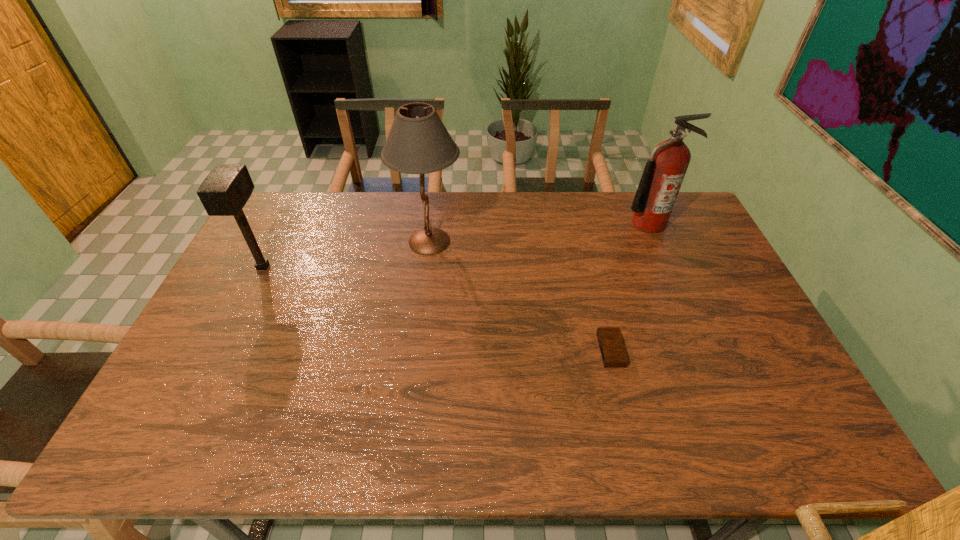
Locate an element on the screen. This screenshot has width=960, height=540. the third object from right to left is located at coordinates (418, 143).

Find the location of `the rightmost object`. the rightmost object is located at coordinates (664, 172).

The width and height of the screenshot is (960, 540). Identify the location of the leftmost object. (224, 192).

Image resolution: width=960 pixels, height=540 pixels. Find the location of `mallet`. mallet is located at coordinates (224, 192).

This screenshot has height=540, width=960. I want to click on alarm clock, so click(612, 349).

You are a GUI agent. You are given a task and a screenshot of the screen. Output one action in this format:
    pyautogui.click(x=<x>, y=<y>)
    Task: Click on the third object from left to right
    
    Given the screenshot: What is the action you would take?
    pyautogui.click(x=612, y=349)

You are a GUI agent. You are given a task and a screenshot of the screen. Output one action in this format:
    pyautogui.click(x=<x>, y=<y>)
    Task: Click on the free space located on the front-facing side of the third object from right to left
    The width and height of the screenshot is (960, 540).
    Given the screenshot: What is the action you would take?
    pyautogui.click(x=565, y=241)

Where is `free space located on the front of the rightmost object near the operation label`? The image size is (960, 540). free space located on the front of the rightmost object near the operation label is located at coordinates (668, 270).

The width and height of the screenshot is (960, 540). What are the coordinates of `free space located 0.180m on the front of the leftmost object` in the screenshot? It's located at (232, 328).

Locate an element on the screen. blank space located 0.400m on the front face of the alarm clock is located at coordinates (452, 350).